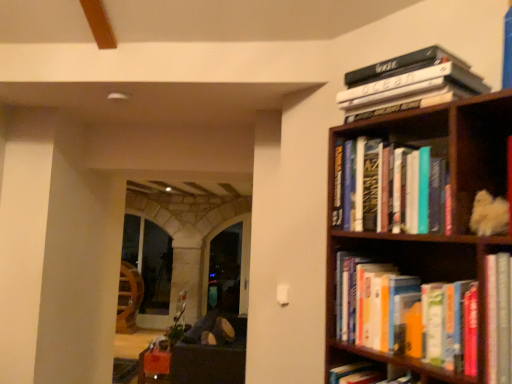
Question: Is hardcover books at upper right, the 1th book viewed from the top, taller or shorter than dark brown leather couch at lower left?

Choices:
 (A) short
 (B) tall

Answer: (A)

Question: Looking at the image, does hardcover books at upper right, which is counted as the 3th book, starting from the bottom, seem bigger or smaller compared to dark brown leather couch at lower left?

Choices:
 (A) big
 (B) small

Answer: (B)

Question: Which object is positioned farthest from the hardcover books at upper right, the 1th book viewed from the top?

Choices:
 (A) dark brown leather couch at lower left
 (B) hardcover books at right, which is counted as the 1th book, starting from the bottom
 (C) hardcover books at upper right, the 2th book ordered from the bottom
 (D) transparent glass door at center

Answer: (D)

Question: Which object is the closest to the hardcover books at upper right, the 2th book ordered from the bottom?

Choices:
 (A) hardcover books at upper right, which is counted as the 3th book, starting from the bottom
 (B) transparent glass door at center
 (C) hardcover books at right, which is counted as the 1th book, starting from the bottom
 (D) dark brown leather couch at lower left

Answer: (A)